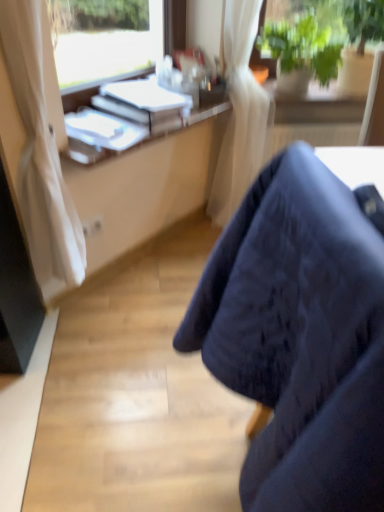
I want to click on vacant space underneath white paper at upper center, which is the 1th book from top to bottom (from a real-world perspective), so click(161, 250).